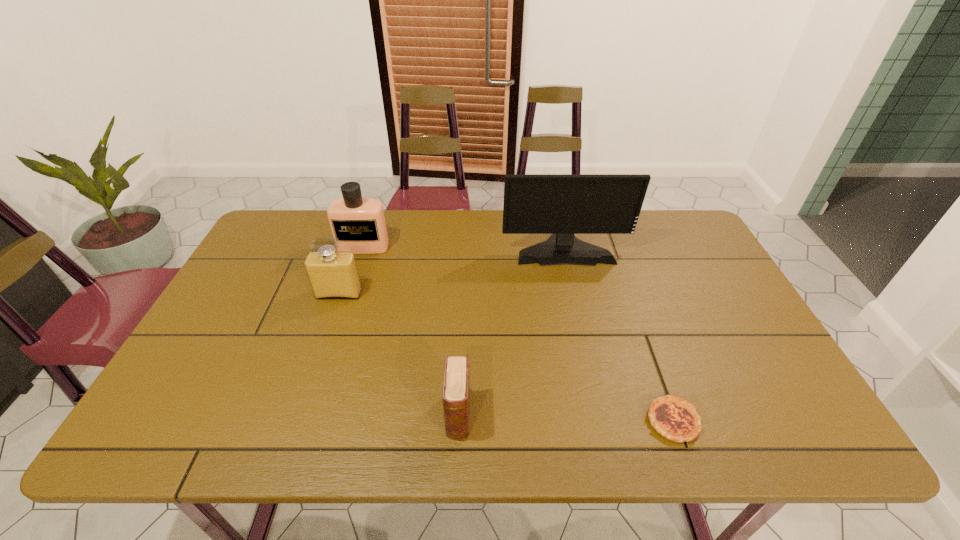
Identify which object is the second closest to the farther perfume. Please provide its 2D coordinates. Your answer should be formatted as a tuple, i.e. [(x, y)], where the tuple contains the x and y coordinates of a point satisfying the conditions above.

[(562, 205)]

Locate an element on the screen. The height and width of the screenshot is (540, 960). object that is the second closest to the tallest object is located at coordinates pos(332,274).

At what (x,y) coordinates should I click in order to perform the action: click on free spot that satisfies the following two spatial constraints: 1. on the front label of the farther perfume; 2. on the left side of the quiche. Please return your answer as a coordinate pair (x, y). The width and height of the screenshot is (960, 540). Looking at the image, I should click on (308, 421).

Locate an element on the screen. The width and height of the screenshot is (960, 540). vacant area in the image that satisfies the following two spatial constraints: 1. on the front label of the shortest object; 2. on the right side of the farther perfume is located at coordinates (308, 421).

Where is `free space that satisfies the following two spatial constraints: 1. on the front-facing side of the third nearest object; 2. on the right side of the quiche`? The height and width of the screenshot is (540, 960). free space that satisfies the following two spatial constraints: 1. on the front-facing side of the third nearest object; 2. on the right side of the quiche is located at coordinates click(x=296, y=421).